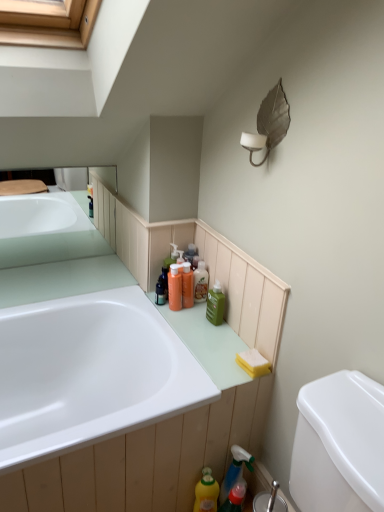
At what (x,y) coordinates should I click in order to perform the action: click on free spot to the right of orange plastic bottles at center, which is counted as the second toiletry, starting from the right. Please return your answer as a coordinate pair (x, y). The width and height of the screenshot is (384, 512). Looking at the image, I should click on (208, 316).